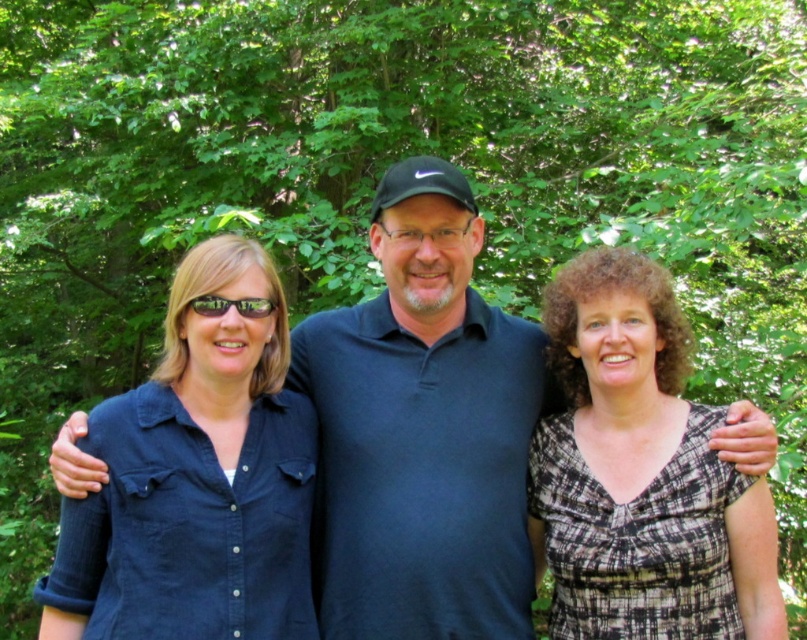
You are taking a photo of the three people in the scene. You want to focus on the person at point [601,362] and the person at point [251,298]. Which person will be in focus if you adjust the camera to focus on the closer one?

The person at point [251,298] will be in focus because it is closer to the camera than the person at point [601,362].